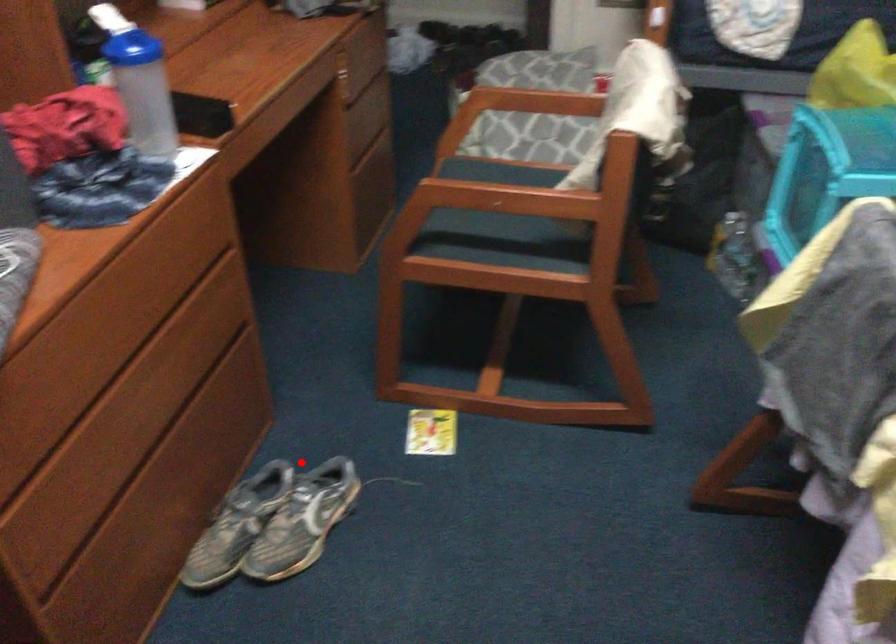
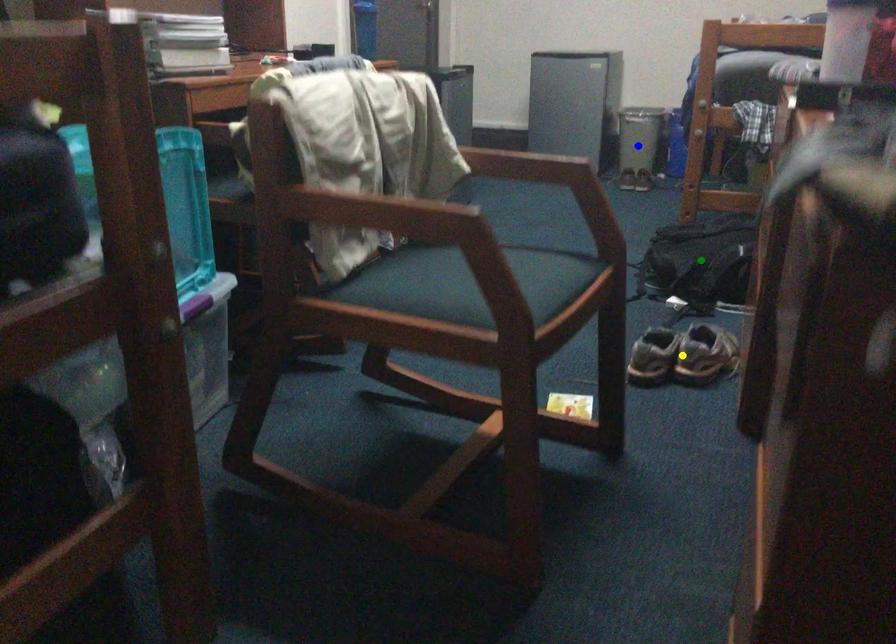
Question: I am providing you with two images of the same scene from different viewpoints. A red point is marked on the first image. You are given multiple points on the second image. Which spot in image 2 lines up with the point in image 1?

Choices:
 (A) green point
 (B) yellow point
 (C) blue point

Answer: (B)